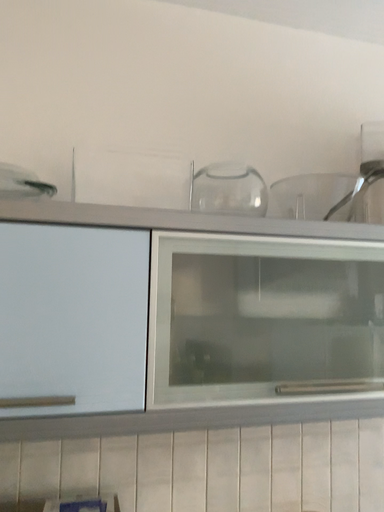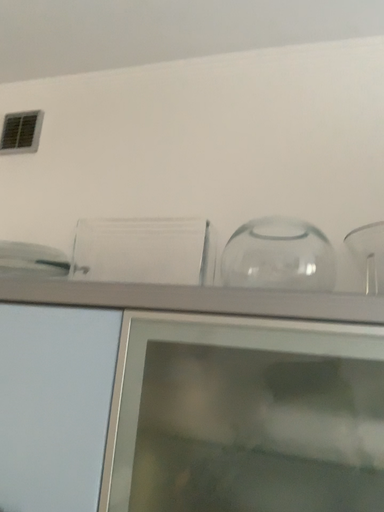
Question: How did the camera likely rotate when shooting the video?

Choices:
 (A) rotated downward
 (B) rotated upward

Answer: (B)